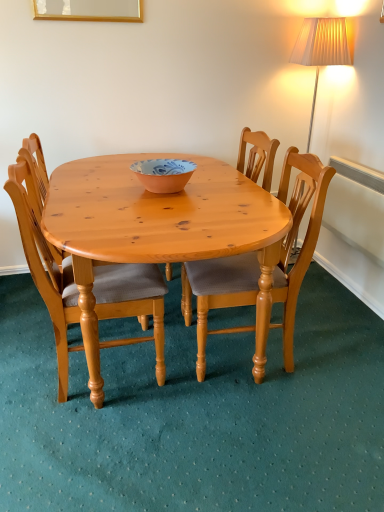
Question: Is light brown wooden chair at center, the third chair when ordered from right to left, wider or thinner than light brown wood chair at center, the 3th chair in the left-to-right sequence?

Choices:
 (A) wide
 (B) thin

Answer: (B)

Question: From the image's perspective, is light brown wooden chair at center, the first chair when ordered from left to right, located above or below light brown wood chair at center, acting as the 1th chair starting from the right?

Choices:
 (A) below
 (B) above

Answer: (A)

Question: Based on their relative distances, which object is nearer to the wooden chair at center, positioned as the second chair in right-to-left order?

Choices:
 (A) light brown wood chair at center, the 3th chair in the left-to-right sequence
 (B) blue and white ceramic bowl at center
 (C) light brown wooden chair at center, the third chair when ordered from right to left

Answer: (A)

Question: Based on their relative distances, which object is farther from the wooden chair at center, positioned as the second chair in right-to-left order?

Choices:
 (A) blue and white ceramic bowl at center
 (B) light brown wooden chair at center, the third chair when ordered from right to left
 (C) light brown wood chair at center, the 3th chair in the left-to-right sequence

Answer: (B)